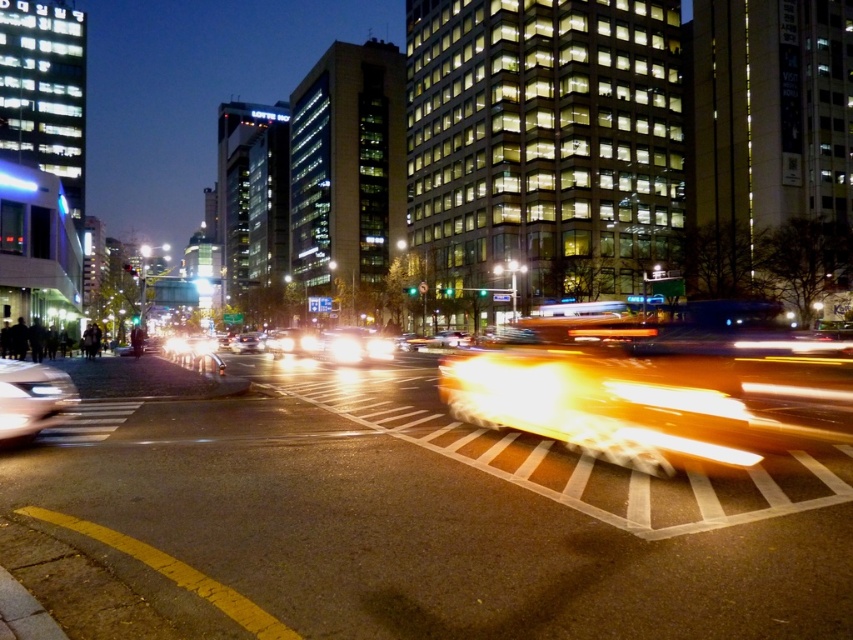
Does yellow metallic taxi at center appear on the left side of yellow metallic car at center?

Incorrect, yellow metallic taxi at center is not on the left side of yellow metallic car at center.

Between yellow metallic taxi at center and yellow metallic car at center, which one has less height?

yellow metallic car at center is shorter.

Is point (668, 410) closer to viewer compared to point (469, 339)?

Yes, point (668, 410) is closer to viewer.

At what (x,y) coordinates should I click in order to perform the action: click on yellow metallic taxi at center. Please return your answer as a coordinate pair (x, y). The width and height of the screenshot is (853, 640). Looking at the image, I should click on (653, 384).

Is yellow metallic taxi at center above shiny silver sedan at center?

Indeed, yellow metallic taxi at center is positioned over shiny silver sedan at center.

Locate an element on the screen. This screenshot has height=640, width=853. yellow metallic taxi at center is located at coordinates (653, 384).

Is point (509, 339) farther from viewer compared to point (247, 348)?

No, it is not.

Image resolution: width=853 pixels, height=640 pixels. Identify the location of yellow metallic taxi at center. point(653,384).

Between shiny silver sedan at center and yellow metallic car at center, which one is positioned lower?

shiny silver sedan at center is lower down.

Is shiny silver sedan at center closer to camera compared to yellow metallic car at center?

Yes, it is in front of yellow metallic car at center.

Between point (262, 339) and point (433, 340), which one is positioned behind?

Point (433, 340)

Identify the location of shiny silver sedan at center. The image size is (853, 640). (247, 342).